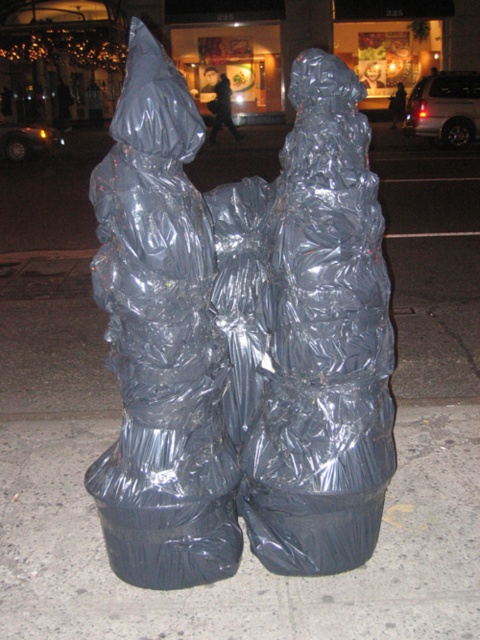
Question: Which object appears farthest from the camera in this image?

Choices:
 (A) black plastic bags at center
 (B) clear plastic sculpture at center

Answer: (A)

Question: Among these points, which one is nearest to the camera?

Choices:
 (A) (232, 252)
 (B) (337, 632)
 (C) (348, 156)

Answer: (B)

Question: Is black plastic bags at center positioned before satin silver sculpture at center?

Choices:
 (A) yes
 (B) no

Answer: (A)

Question: Which object is the closest to the satin silver sculpture at center?

Choices:
 (A) clear plastic sculpture at center
 (B) black plastic bags at center

Answer: (A)

Question: Is clear plastic sculpture at center smaller than satin silver sculpture at center?

Choices:
 (A) no
 (B) yes

Answer: (A)

Question: From the image, what is the correct spatial relationship of black plastic bags at center in relation to satin silver sculpture at center?

Choices:
 (A) right
 (B) left

Answer: (B)